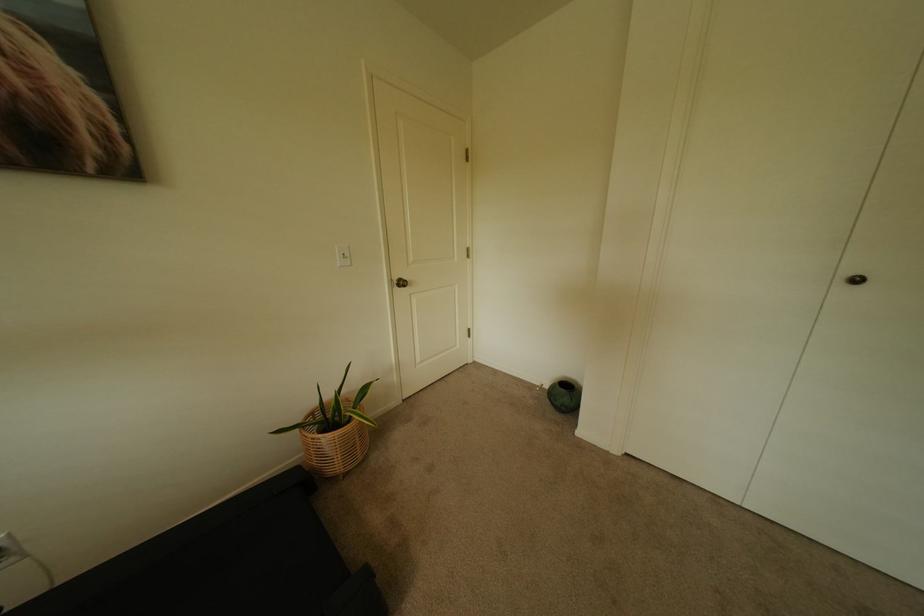
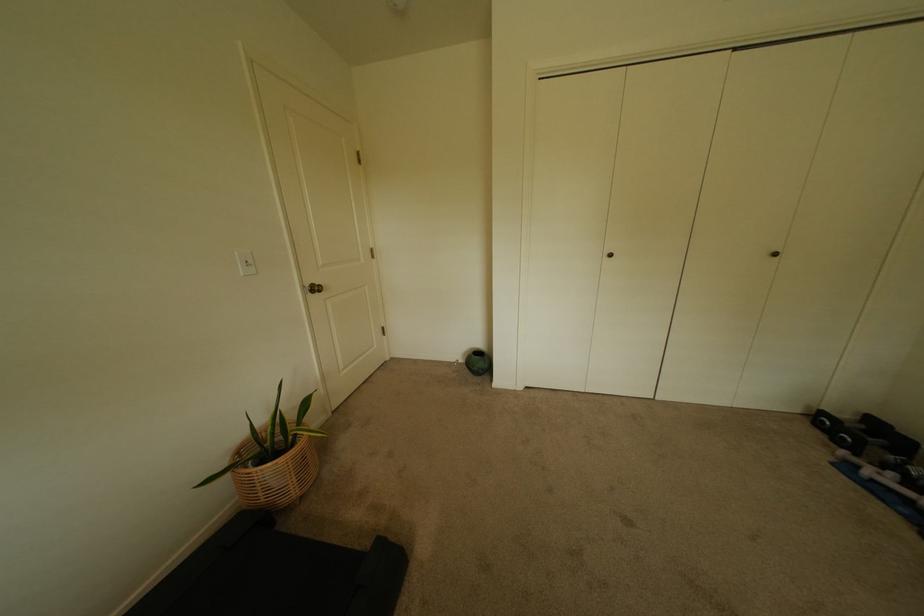
Based on the photo, in a continuous first-person perspective shot, in which direction is the camera moving?

The cameraman moved toward left, backward.